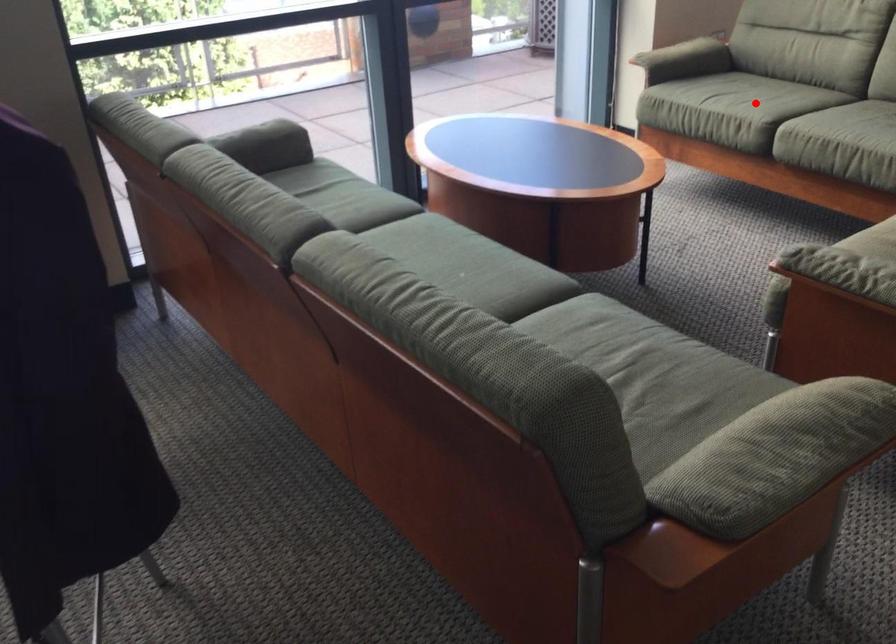
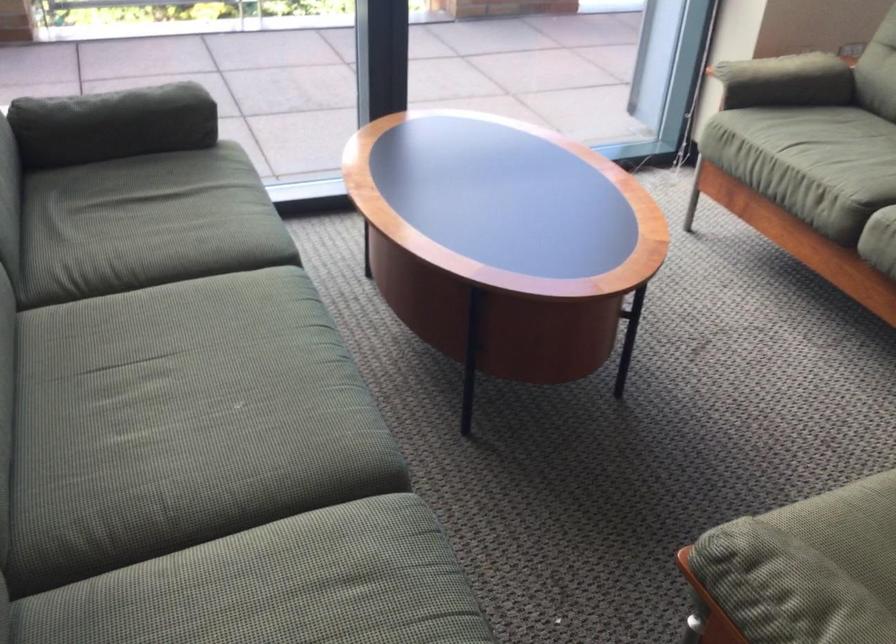
Question: I am providing you with two images of the same scene from different viewpoints. In image1, a red point is highlighted. Considering the same 3D point in image2, which of the following is correct?

Choices:
 (A) It is closer
 (B) It is farther

Answer: (A)